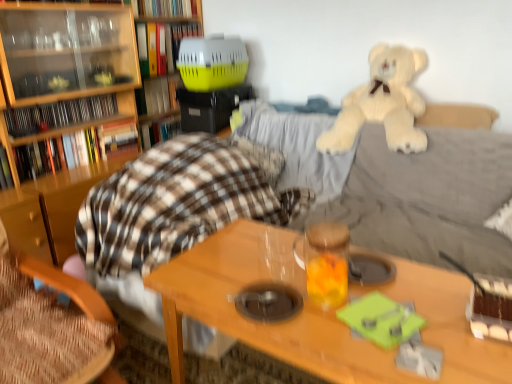
Question: In the image, is wooden table at center on the left side or the right side of hardcover book at left, acting as the 6th book starting from the top?

Choices:
 (A) right
 (B) left

Answer: (A)

Question: From the image's perspective, is wooden table at center located above or below hardcover book at left, which is the second book in bottom-to-top order?

Choices:
 (A) below
 (B) above

Answer: (A)

Question: Which of these objects is positioned closest to the translucent glass jar at center?

Choices:
 (A) wooden chair at lower left
 (B) matte black book at left, the fourth book positioned from the top
 (C) hardcover book at upper center, which is counted as the 7th book, starting from the bottom
 (D) yellow plastic pet carrier at upper center, arranged as the second book when viewed from the top
 (E) yellow plastic pet carrier at upper center, the 5th book from the bottom

Answer: (A)

Question: Based on their relative distances, which object is farther from the wooden table at center?

Choices:
 (A) yellow plastic pet carrier at upper center, the 5th book from the bottom
 (B) hardcover book at left, acting as the 6th book starting from the top
 (C) hardcover book at upper center, the first book when ordered from top to bottom
 (D) white plush teddy bear at upper right
 (E) translucent glass jar at center

Answer: (C)